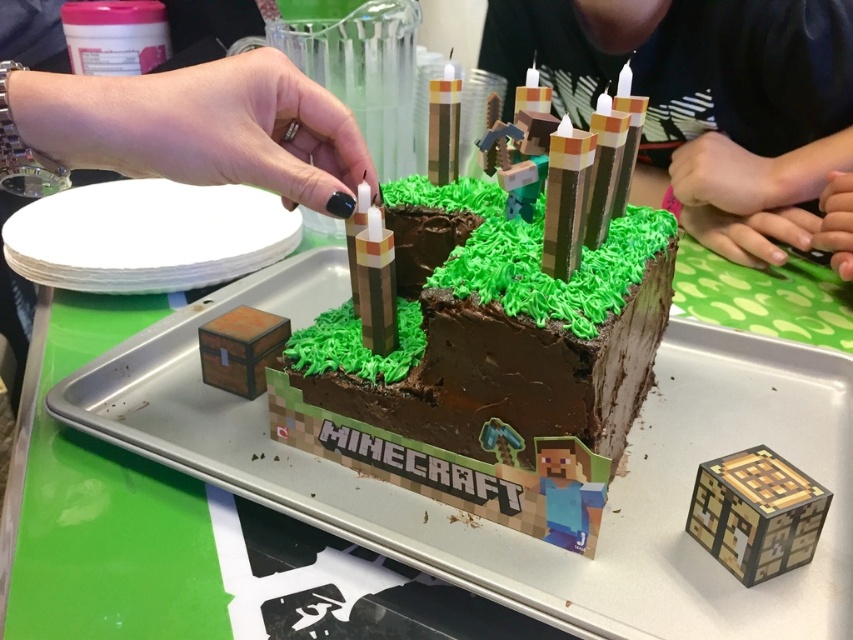
Does chocolate matte block at center appear on the left side of smooth brown cake at center?

Yes, chocolate matte block at center is to the left of smooth brown cake at center.

Does chocolate matte block at center have a greater width compared to smooth brown cake at center?

No.

Does point (334, 397) lie behind point (631, 48)?

No.

This screenshot has height=640, width=853. In order to click on chocolate matte block at center in this screenshot , I will do `click(509, 326)`.